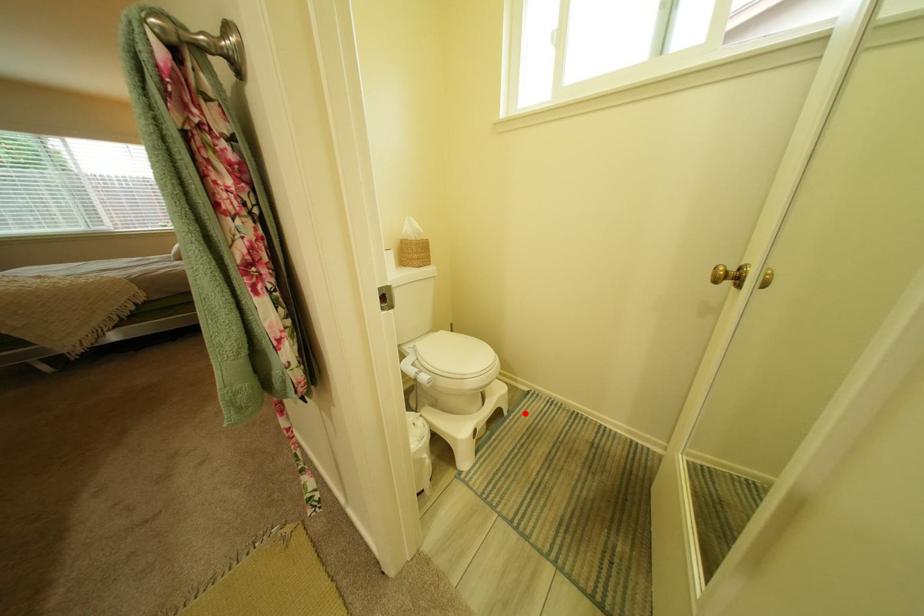
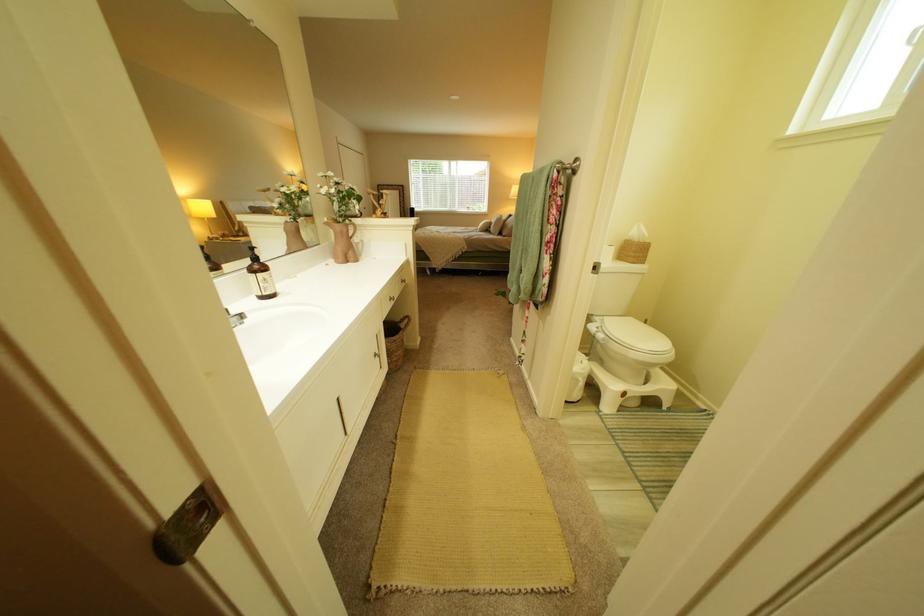
Question: A red point is marked in image1. In image2, is the corresponding 3D point closer to the camera or farther? Reply with the corresponding letter.

Choices:
 (A) The corresponding 3D point is closer.
 (B) The corresponding 3D point is farther.

Answer: (A)